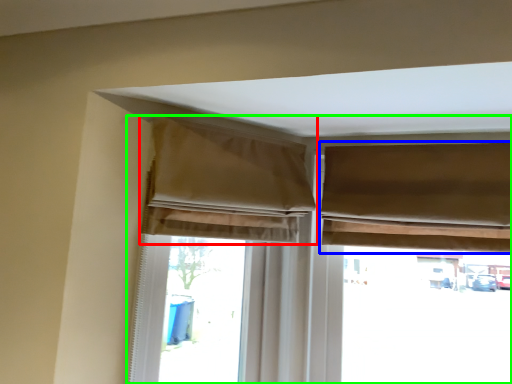
Question: Which is farther away from curtain (highlighted by a red box)? curtain (highlighted by a blue box) or window (highlighted by a green box)?

Choices:
 (A) curtain
 (B) window

Answer: (A)